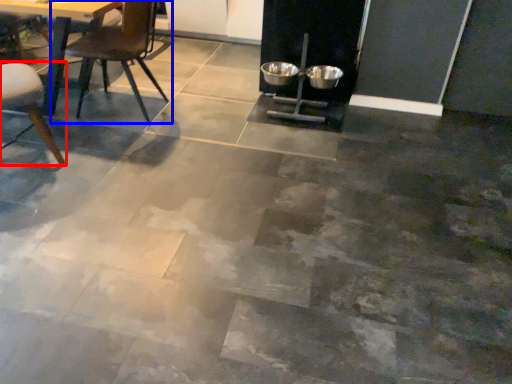
Question: Which object appears closest to the camera in this image, chair (highlighted by a red box) or chair (highlighted by a blue box)?

Choices:
 (A) chair
 (B) chair

Answer: (A)